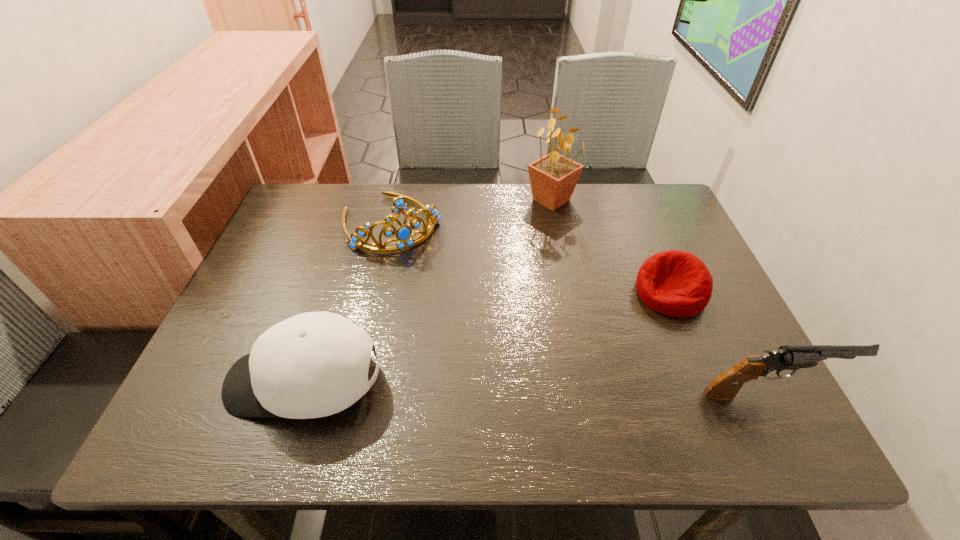
Identify the location of vacant region located 0.110m at the front of the third object from left to right with flowers visible. (557, 241).

Find the location of a particular element. This screenshot has width=960, height=540. vacant space situated at the front of the third object from left to right with flowers visible is located at coordinates (567, 313).

What are the coordinates of `vacant space located 0.200m at the front of the third object from left to right with flowers visible` in the screenshot? It's located at (561, 264).

Locate an element on the screen. This screenshot has height=540, width=960. free location located 0.260m on the front-facing side of the tiara is located at coordinates (452, 320).

Locate an element on the screen. vacant space situated on the front-facing side of the tiara is located at coordinates (470, 349).

This screenshot has width=960, height=540. I want to click on blank space located on the front-facing side of the tiara, so click(435, 291).

I want to click on sunflower located in the far edge section of the desktop, so click(553, 178).

The height and width of the screenshot is (540, 960). In order to click on tiara that is at the far edge in this screenshot , I will do `click(403, 234)`.

Locate an element on the screen. Image resolution: width=960 pixels, height=540 pixels. baseball cap at the near edge is located at coordinates click(x=315, y=364).

The image size is (960, 540). In order to click on gun located at the near edge in this screenshot , I will do `click(725, 386)`.